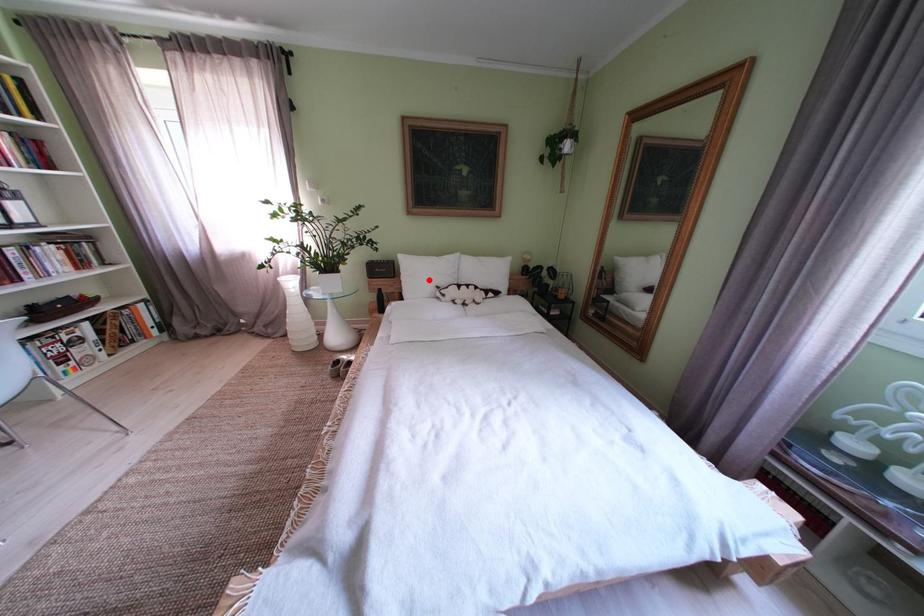
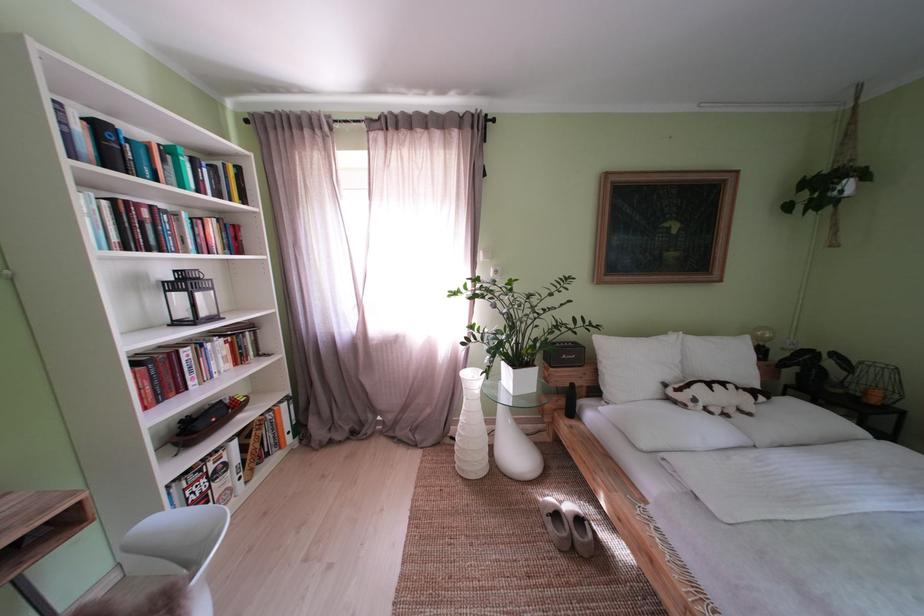
In the second image, find the point that corresponds to the highlighted location in the first image.

(639, 369)